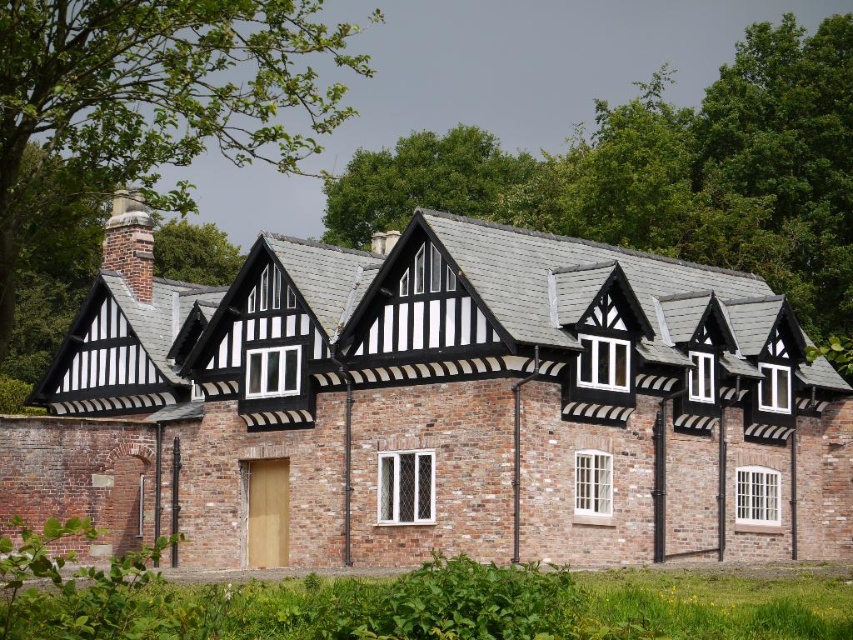
You are standing in front of the traditional brick building with a Tudor style. There is a point marked at coordinates point [612,540]. Can you determine if this point is closer to you or farther away than the wooden door at the lower level?

The distance of point [612,540] from viewer is 227.35 feet, but the wooden door at the lower level is closer to the viewer than the point. Therefore, the point is farther away than the wooden door at the lower level.

You are an architect evaluating the structural integrity of the building. Given that the black timber trim at center and the brick chimney at upper left are both critical elements, which one might require more reinforcement due to its height?

The black timber trim at center requires more reinforcement because it is much taller than the brick chimney at upper left, making it more susceptible to structural stress.